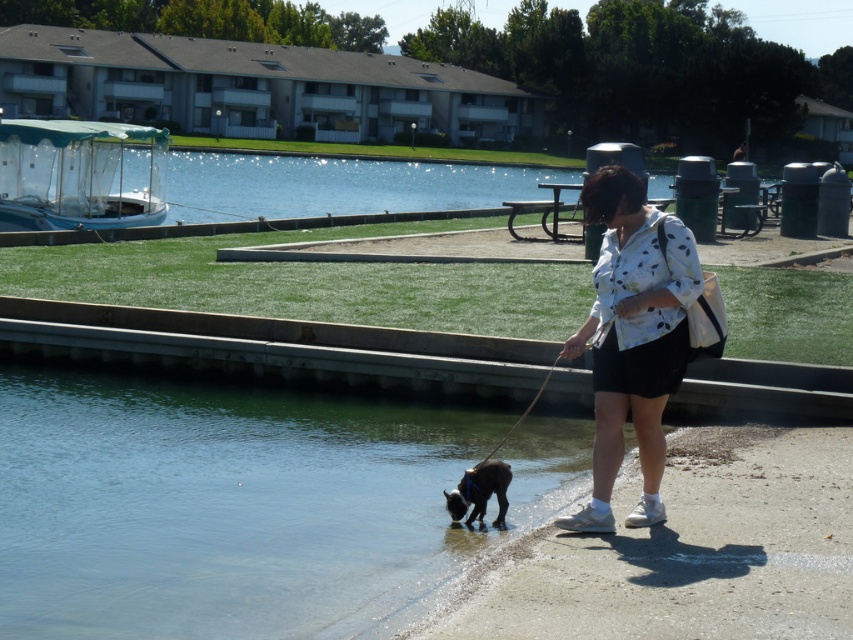
Can you confirm if white dotted shirt at center is thinner than black fur dog at lower left?

No, white dotted shirt at center is not thinner than black fur dog at lower left.

How much distance is there between white dotted shirt at center and black fur dog at lower left?

white dotted shirt at center and black fur dog at lower left are 32.85 inches apart from each other.

You are a GUI agent. You are given a task and a screenshot of the screen. Output one action in this format:
    pyautogui.click(x=<x>, y=<y>)
    Task: Click on the white dotted shirt at center
    This screenshot has width=853, height=640.
    Given the screenshot: What is the action you would take?
    pyautogui.click(x=631, y=339)

Does point (363, 600) lie in front of point (604, 339)?

That is True.

Does clear water at lower left lie behind white dotted shirt at center?

No, it is in front of white dotted shirt at center.

What do you see at coordinates (223, 508) in the screenshot?
I see `clear water at lower left` at bounding box center [223, 508].

Locate an element on the screen. This screenshot has width=853, height=640. clear water at lower left is located at coordinates (223, 508).

Is point (540, 496) positioned behind point (457, 509)?

That is True.

Can you confirm if clear water at lower left is positioned to the left of black fur dog at lower left?

Yes, clear water at lower left is to the left of black fur dog at lower left.

Between point (102, 524) and point (469, 470), which one is positioned behind?

Positioned behind is point (102, 524).

I want to click on clear water at lower left, so click(223, 508).